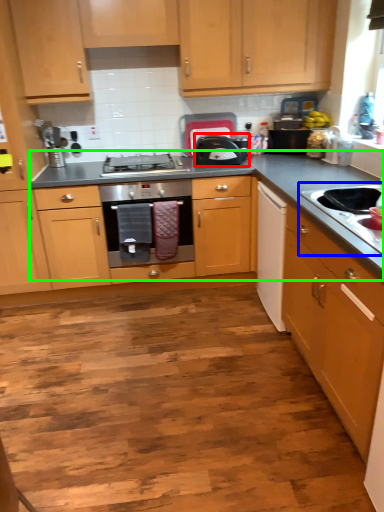
Question: Which object is the farthest from kitchen appliance (highlighted by a red box)? Choose among these: sink (highlighted by a blue box) or countertop (highlighted by a green box).

Choices:
 (A) sink
 (B) countertop

Answer: (A)